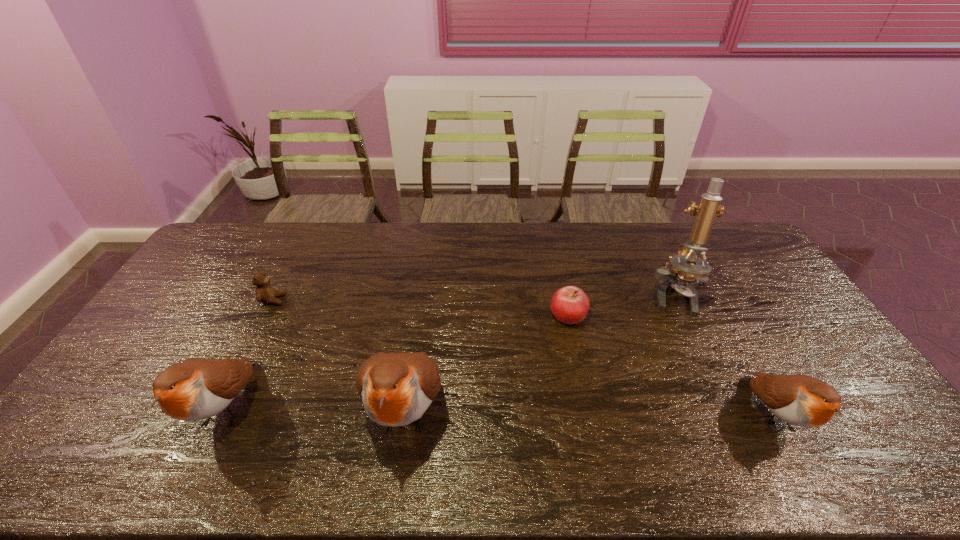
This screenshot has height=540, width=960. Identify the location of vacant space located 0.290m on the left of the fourth object from left to right. (458, 315).

This screenshot has width=960, height=540. Identify the location of vacant space at the far edge of the desktop. (526, 251).

The width and height of the screenshot is (960, 540). I want to click on vacant space at the near edge of the desktop, so click(x=214, y=417).

Locate an element on the screen. The image size is (960, 540). free space at the left edge of the desktop is located at coordinates (143, 334).

This screenshot has height=540, width=960. Find the location of `blank space at the right edge of the desktop`. blank space at the right edge of the desktop is located at coordinates (763, 329).

Where is `free spot between the teddy bear and the apple`? The width and height of the screenshot is (960, 540). free spot between the teddy bear and the apple is located at coordinates (420, 307).

You are a GUI agent. You are given a task and a screenshot of the screen. Output one action in this format:
    pyautogui.click(x=<x>, y=<y>)
    Task: Click on the empty space that is in between the microscope and the leftmost bird
    
    Given the screenshot: What is the action you would take?
    pyautogui.click(x=449, y=352)

Where is `free space between the fourth tallest object and the leftmost bird`? free space between the fourth tallest object and the leftmost bird is located at coordinates (499, 411).

Where is `vacant point located between the teddy bear and the fourth tallest object`? This screenshot has height=540, width=960. vacant point located between the teddy bear and the fourth tallest object is located at coordinates (523, 357).

Locate an element on the screen. free space that is in between the second bird from left to right and the third object from right to left is located at coordinates (488, 363).